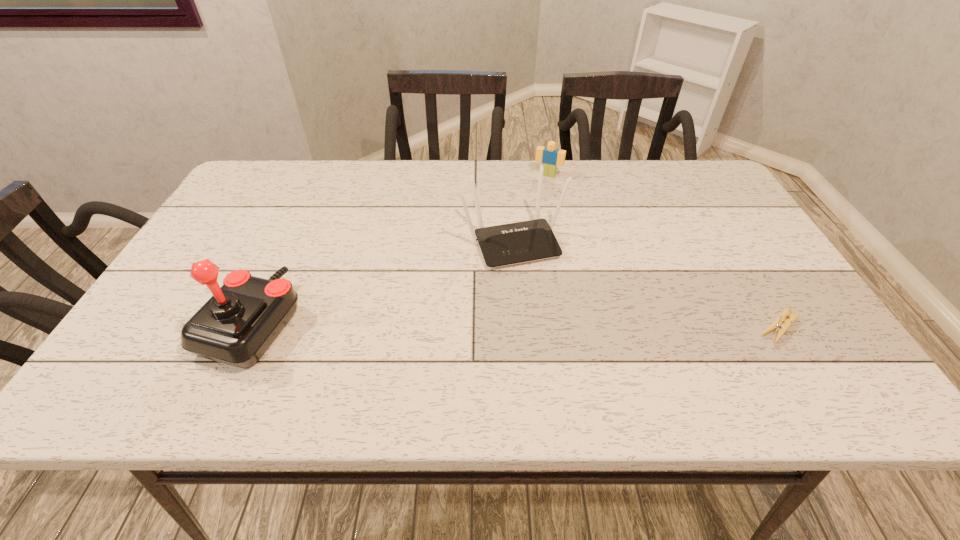
At what (x,y) coordinates should I click in order to perform the action: click on vacant area situated on the front-facing side of the router. Please return your answer as a coordinate pair (x, y). Image resolution: width=960 pixels, height=540 pixels. Looking at the image, I should click on (557, 330).

The image size is (960, 540). Identify the location of blank space located 0.190m on the front-facing side of the router. (557, 330).

The image size is (960, 540). In order to click on free point located on the face of the Lego in this screenshot , I will do `click(532, 204)`.

This screenshot has height=540, width=960. I want to click on free space located 0.050m on the face of the Lego, so click(x=540, y=187).

This screenshot has width=960, height=540. Identify the location of vacant region located on the face of the Lego. (523, 222).

What are the coordinates of `object at the far edge` in the screenshot? It's located at (550, 157).

This screenshot has height=540, width=960. I want to click on joystick at the near edge, so click(236, 326).

Identify the location of clothespin that is positioned at the near edge. (776, 326).

You are a GUI agent. You are given a task and a screenshot of the screen. Output one action in this format:
    pyautogui.click(x=<x>, y=<y>)
    Task: Click on the object located in the left edge section of the desktop
    
    Given the screenshot: What is the action you would take?
    (x=236, y=326)

The width and height of the screenshot is (960, 540). Identify the location of object that is at the right edge. (776, 326).